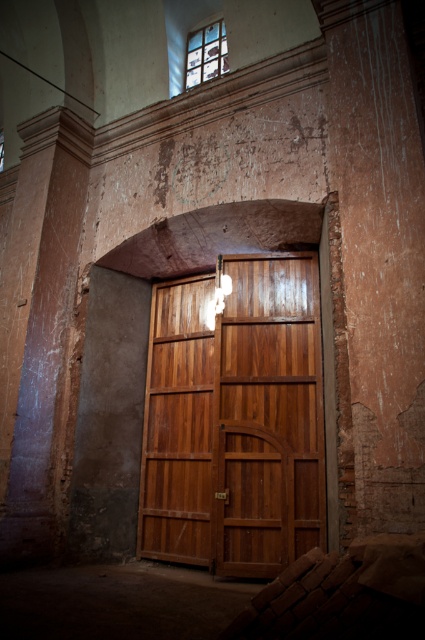
Is shiny brown wood door at center in front of smooth pinkish-brown stone pillar at left?

Yes.

In the scene shown: Can you confirm if shiny brown wood door at center is positioned above smooth pinkish-brown stone pillar at left?

No.

The height and width of the screenshot is (640, 425). What do you see at coordinates (235, 419) in the screenshot?
I see `shiny brown wood door at center` at bounding box center [235, 419].

Locate an element on the screen. shiny brown wood door at center is located at coordinates (235, 419).

Does smooth reddish-brown wood at right come behind smooth pinkish-brown stone pillar at left?

No, smooth reddish-brown wood at right is in front of smooth pinkish-brown stone pillar at left.

Can you confirm if smooth reddish-brown wood at right is positioned to the right of smooth pinkish-brown stone pillar at left?

Yes, smooth reddish-brown wood at right is to the right of smooth pinkish-brown stone pillar at left.

Between point (340, 28) and point (61, 278), which one is positioned in front?

Point (340, 28) is more forward.

This screenshot has height=640, width=425. Find the location of `smooth reddish-brown wood at right`. smooth reddish-brown wood at right is located at coordinates (379, 253).

Between shiny brown wood door at center and smooth reddish-brown wood at right, which one is positioned higher?

smooth reddish-brown wood at right is above.

Can you confirm if shiny brown wood door at center is positioned to the left of smooth reddish-brown wood at right?

Correct, you'll find shiny brown wood door at center to the left of smooth reddish-brown wood at right.

Is point (166, 387) positioned in front of point (394, 56)?

No, (166, 387) is further to viewer.

Where is `shiny brown wood door at center`? This screenshot has height=640, width=425. shiny brown wood door at center is located at coordinates (235, 419).